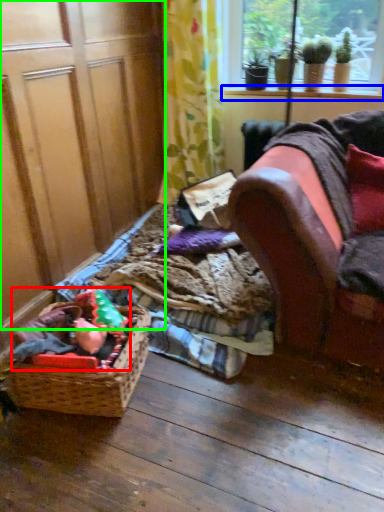
Question: Which object is positioned farthest from stuff (highlighted by a red box)? Select from window sill (highlighted by a blue box) and screen door (highlighted by a green box).

Choices:
 (A) window sill
 (B) screen door

Answer: (A)